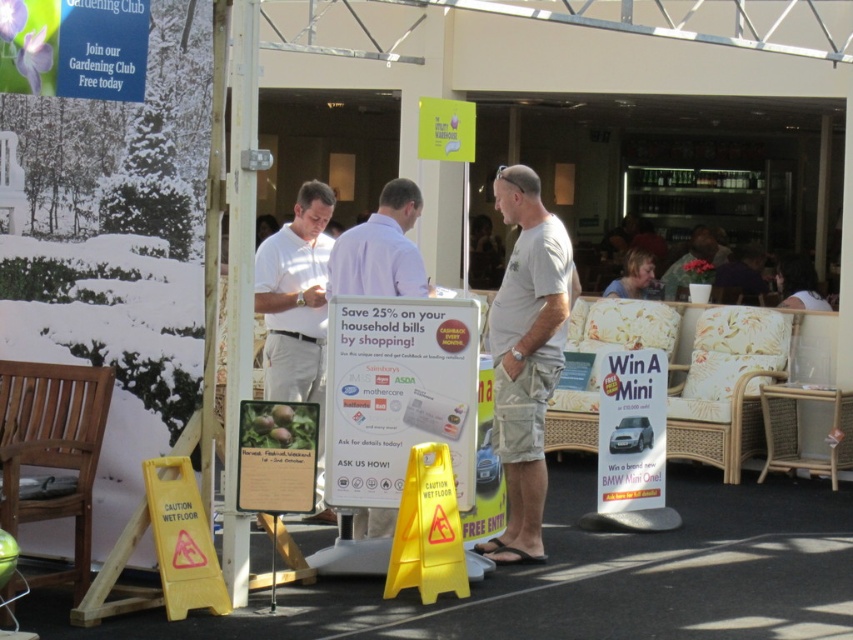
Question: Which object is farther from the camera taking this photo?

Choices:
 (A) white cotton t-shirt at center
 (B) white paper sign at center

Answer: (A)

Question: Considering the relative positions of white cotton t-shirt at center and white cotton shirt at center in the image provided, where is white cotton t-shirt at center located with respect to white cotton shirt at center?

Choices:
 (A) below
 (B) above

Answer: (A)

Question: Which point is farther to the camera?

Choices:
 (A) (387, 332)
 (B) (323, 256)
 (C) (518, 426)

Answer: (B)

Question: Is white paper sign at center bigger than white cotton shirt at center?

Choices:
 (A) yes
 (B) no

Answer: (B)

Question: Can you confirm if white paper sign at center is bigger than light blue shirt at center?

Choices:
 (A) yes
 (B) no

Answer: (A)

Question: Which of the following is the closest to the observer?

Choices:
 (A) (664, 477)
 (B) (502, 385)
 (C) (358, 509)

Answer: (B)